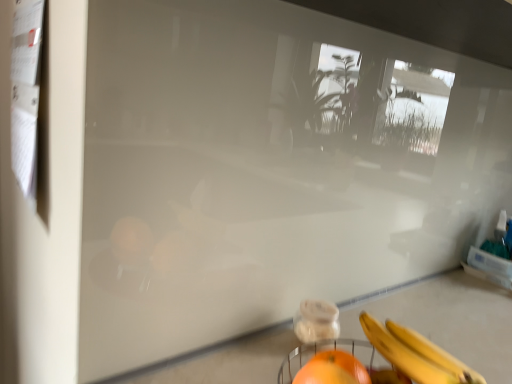
Identify the location of clear glass bowl at lower center. (449, 319).

The width and height of the screenshot is (512, 384). What do you see at coordinates (449, 319) in the screenshot?
I see `clear glass bowl at lower center` at bounding box center [449, 319].

Locate an element on the screen. The height and width of the screenshot is (384, 512). clear glass bowl at lower center is located at coordinates (449, 319).